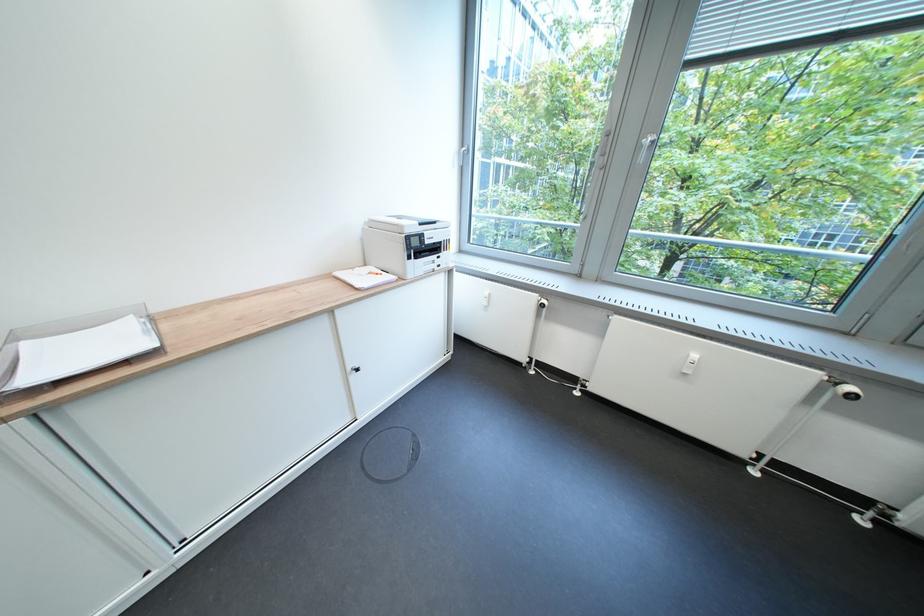
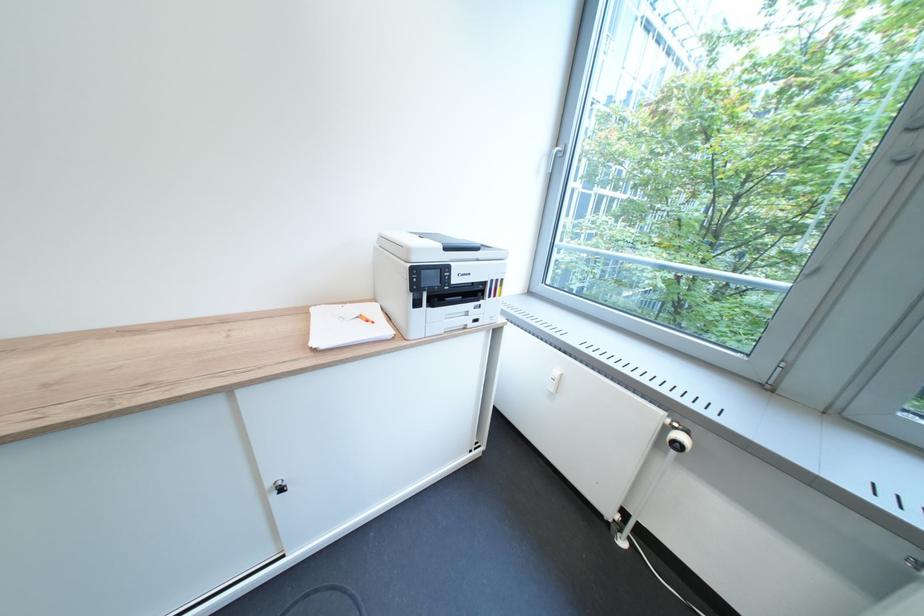
Find the pixel in the second image that matches point (553, 305) in the first image.

(687, 443)